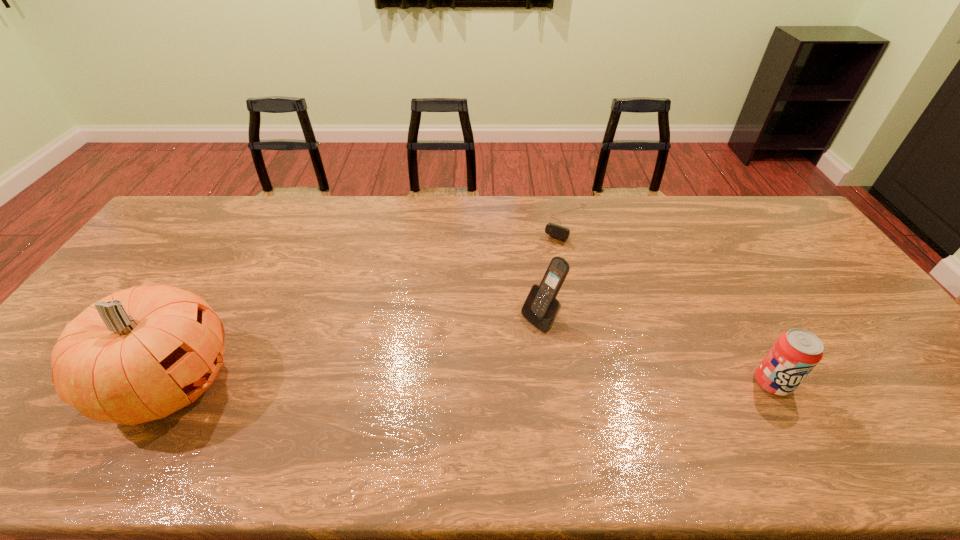
Locate an element on the screen. The width and height of the screenshot is (960, 540). the leftmost object is located at coordinates (140, 354).

This screenshot has height=540, width=960. In order to click on the tallest object in this screenshot , I will do `click(140, 354)`.

In order to click on the rightmost object in this screenshot , I will do pyautogui.click(x=794, y=355).

What are the coordinates of `soda can` in the screenshot? It's located at (794, 355).

Identify the location of the farthest object. (557, 231).

Where is `webcam`? webcam is located at coordinates (557, 231).

Where is `cellular telephone`? This screenshot has width=960, height=540. cellular telephone is located at coordinates (541, 307).

Locate an element on the screen. The height and width of the screenshot is (540, 960). free spot located 0.250m on the front-facing side of the tallest object is located at coordinates (337, 383).

Find the location of a particular element. This screenshot has height=540, width=960. blank space located 0.050m on the surface of the second shortest object is located at coordinates (792, 418).

Find the location of a particular element. The image size is (960, 540). free space located on the front-facing side of the farthest object is located at coordinates (511, 307).